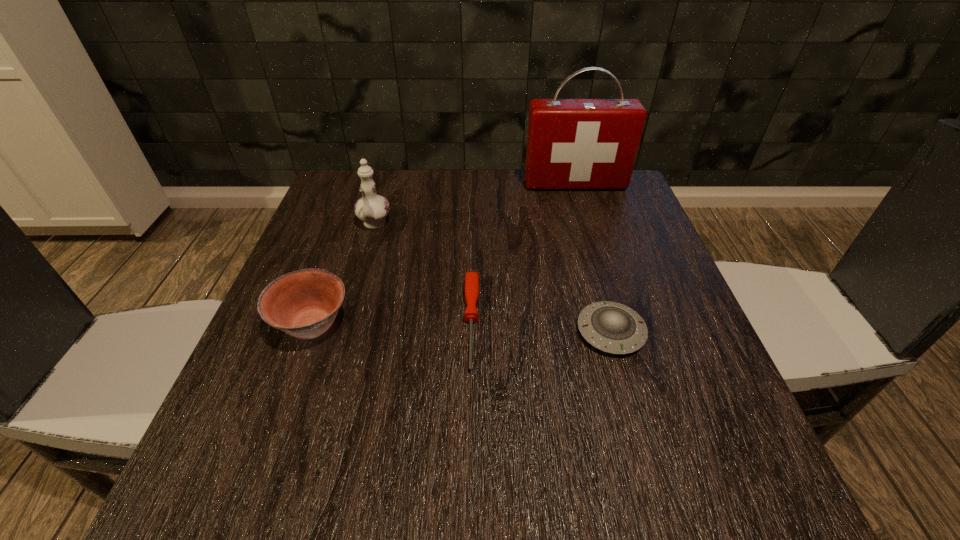
Identify the location of vacant region located 0.370m on the back of the bowl. (360, 194).

Where is `blank area located on the left of the fourth tallest object`? The width and height of the screenshot is (960, 540). blank area located on the left of the fourth tallest object is located at coordinates click(396, 332).

Locate an element on the screen. The height and width of the screenshot is (540, 960). vacant space located at the tip of the screwdriver is located at coordinates (468, 508).

I want to click on the first-aid kit positioned at the far edge, so click(572, 144).

I want to click on chinaware that is positioned at the far edge, so click(x=372, y=209).

Identify the location of chinaware at the left edge. This screenshot has width=960, height=540. (372, 209).

The height and width of the screenshot is (540, 960). I want to click on bowl located at the left edge, so click(x=304, y=304).

Locate an element on the screen. the first-aid kit at the right edge is located at coordinates (572, 144).

The image size is (960, 540). What are the coordinates of `saucer positioned at the right edge` in the screenshot? It's located at (611, 327).

Locate an element on the screen. The width and height of the screenshot is (960, 540). object that is at the far left corner is located at coordinates (372, 209).